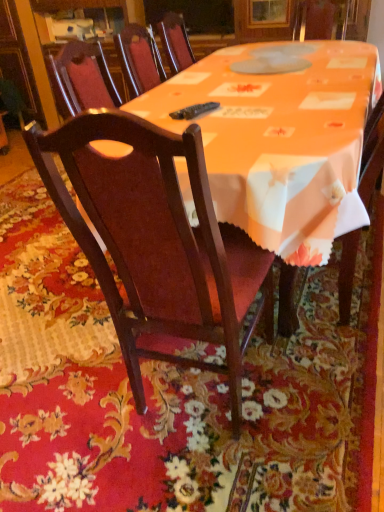
You are a GUI agent. You are given a task and a screenshot of the screen. Output one action in this format:
    pyautogui.click(x=<x>, y=<y>)
    Task: Click on the mahogany wood chair at center
    
    Given the screenshot: What is the action you would take?
    pos(157,241)

What do you see at coordinates (157, 241) in the screenshot? I see `mahogany wood chair at center` at bounding box center [157, 241].

Describe the element at coordinates (18, 61) in the screenshot. I see `glossy wood cabinet at upper left` at that location.

Find the location of `glossy wood cabinet at upper left`. glossy wood cabinet at upper left is located at coordinates (18, 61).

At what (x,y) coordinates should I click in order to perform the action: click on mahogany wood chair at center. Please return your answer as a coordinate pair (x, y). The width and height of the screenshot is (384, 512). Looking at the image, I should click on (157, 241).

Considering the relative positions of glossy wood cabinet at upper left and mahogany wood chair at center in the image provided, is glossy wood cabinet at upper left to the right of mahogany wood chair at center from the viewer's perspective?

Incorrect, glossy wood cabinet at upper left is not on the right side of mahogany wood chair at center.

Does glossy wood cabinet at upper left come behind mahogany wood chair at center?

Yes, it is behind mahogany wood chair at center.

Which is in front, point (26, 54) or point (248, 239)?

The point (248, 239) is more forward.

From the image's perspective, which one is positioned lower, glossy wood cabinet at upper left or mahogany wood chair at center?

mahogany wood chair at center is shown below in the image.

From a real-world perspective, which object rests below the other?

mahogany wood chair at center.

In the scene shown: Considering the relative sizes of glossy wood cabinet at upper left and mahogany wood chair at center in the image provided, is glossy wood cabinet at upper left thinner than mahogany wood chair at center?

Incorrect, the width of glossy wood cabinet at upper left is not less than that of mahogany wood chair at center.

Which of these two, glossy wood cabinet at upper left or mahogany wood chair at center, stands taller?

glossy wood cabinet at upper left.

Is glossy wood cabinet at upper left smaller than mahogany wood chair at center?

Incorrect, glossy wood cabinet at upper left is not smaller in size than mahogany wood chair at center.

Is glossy wood cabinet at upper left outside of mahogany wood chair at center?

Indeed, glossy wood cabinet at upper left is completely outside mahogany wood chair at center.

Is glossy wood cabinet at upper left with mahogany wood chair at center?

No, glossy wood cabinet at upper left is not making contact with mahogany wood chair at center.

Is glossy wood cabinet at upper left oriented away from mahogany wood chair at center?

glossy wood cabinet at upper left does not have its back to mahogany wood chair at center.

What's the angular difference between glossy wood cabinet at upper left and mahogany wood chair at center's facing directions?

There is a 180-degree angle between the facing directions of glossy wood cabinet at upper left and mahogany wood chair at center.

At what (x,y) coordinates should I click in order to perform the action: click on chair on the right of glossy wood cabinet at upper left. Please return your answer as a coordinate pair (x, y). The image size is (384, 512). Looking at the image, I should click on (157, 241).

Between mahogany wood chair at center and glossy wood cabinet at upper left, which one appears on the right side from the viewer's perspective?

Positioned to the right is mahogany wood chair at center.

Which object is more forward, mahogany wood chair at center or glossy wood cabinet at upper left?

mahogany wood chair at center is more forward.

Is point (168, 318) positioned in front of point (10, 47)?

Yes, point (168, 318) is in front of point (10, 47).

From the image's perspective, does mahogany wood chair at center appear higher than glossy wood cabinet at upper left?

Incorrect, from the image's perspective, mahogany wood chair at center is lower than glossy wood cabinet at upper left.

From a real-world perspective, does mahogany wood chair at center sit lower than glossy wood cabinet at upper left?

Correct, in the physical world, mahogany wood chair at center is lower than glossy wood cabinet at upper left.

Considering the relative sizes of mahogany wood chair at center and glossy wood cabinet at upper left in the image provided, is mahogany wood chair at center thinner than glossy wood cabinet at upper left?

Indeed, mahogany wood chair at center has a lesser width compared to glossy wood cabinet at upper left.

Can you confirm if mahogany wood chair at center is shorter than glossy wood cabinet at upper left?

Yes, mahogany wood chair at center is shorter than glossy wood cabinet at upper left.

Does mahogany wood chair at center have a smaller size compared to glossy wood cabinet at upper left?

Correct, mahogany wood chair at center occupies less space than glossy wood cabinet at upper left.

Can we say mahogany wood chair at center lies outside glossy wood cabinet at upper left?

Absolutely, mahogany wood chair at center is external to glossy wood cabinet at upper left.

Are mahogany wood chair at center and glossy wood cabinet at upper left far apart?

Indeed, mahogany wood chair at center is not near glossy wood cabinet at upper left.

Is mahogany wood chair at center looking in the opposite direction of glossy wood cabinet at upper left?

No.

The width and height of the screenshot is (384, 512). Identify the location of chair in front of the glossy wood cabinet at upper left. click(157, 241).

Locate an element on the screen. This screenshot has height=512, width=384. cabinetry behind the mahogany wood chair at center is located at coordinates (18, 61).

This screenshot has width=384, height=512. I want to click on chair that is below the glossy wood cabinet at upper left (from the image's perspective), so click(157, 241).